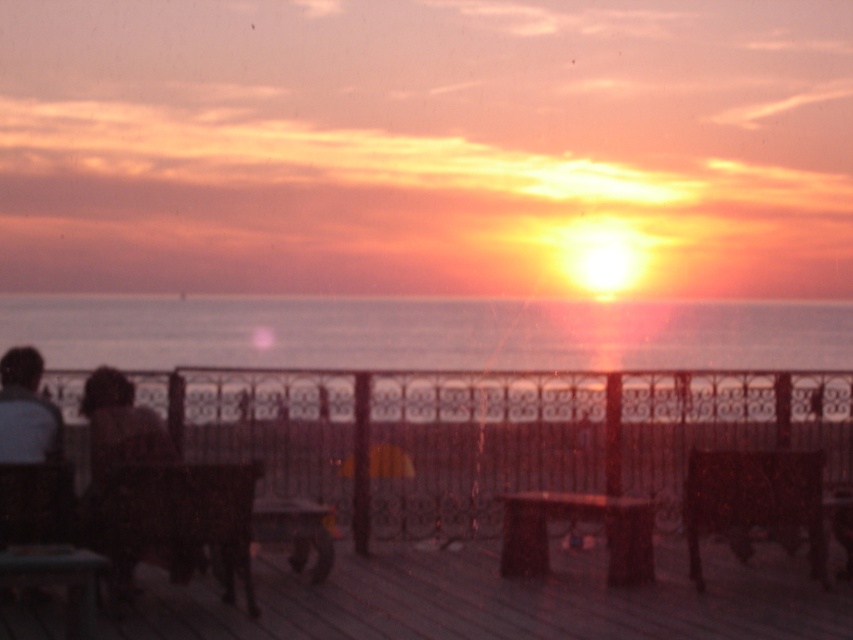
You are standing on the wooden deck and want to take a photo of the sunset. Where should you position yourself to ensure the metallic ornate railing at center is in the frame without blocking the sun?

The metallic ornate railing at center is located at coordinates point (492, 433), so you should position yourself to the left or right of the railing to avoid blocking the sun while keeping it in the frame.

You are a photographer standing on the wooden dock at center, trying to capture the sunset. You notice the dark brown hair at left in your shot. Considering their widths, which object will occupy more space horizontally in your photo?

The dark brown hair at left will occupy more space horizontally in your photo since its width surpasses that of the wooden dock at center.

You are standing on the wooden deck and looking at the metallic ornate railing at center and the smooth ocean water at center. Which object appears larger in the scene?

The smooth ocean water at center appears larger than the metallic ornate railing at center in the scene.